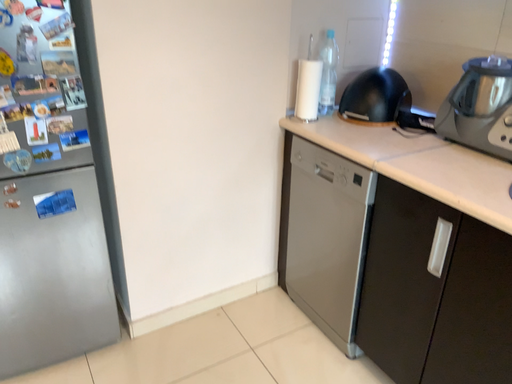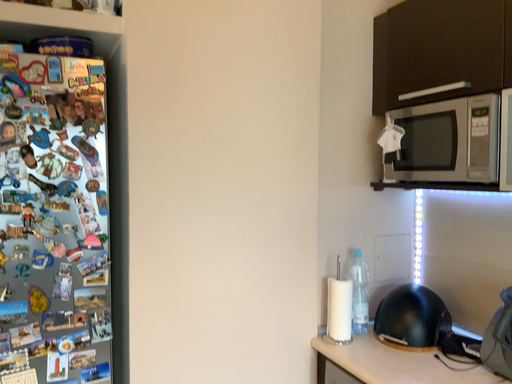
Question: How did the camera likely rotate when shooting the video?

Choices:
 (A) rotated downward
 (B) rotated upward

Answer: (B)